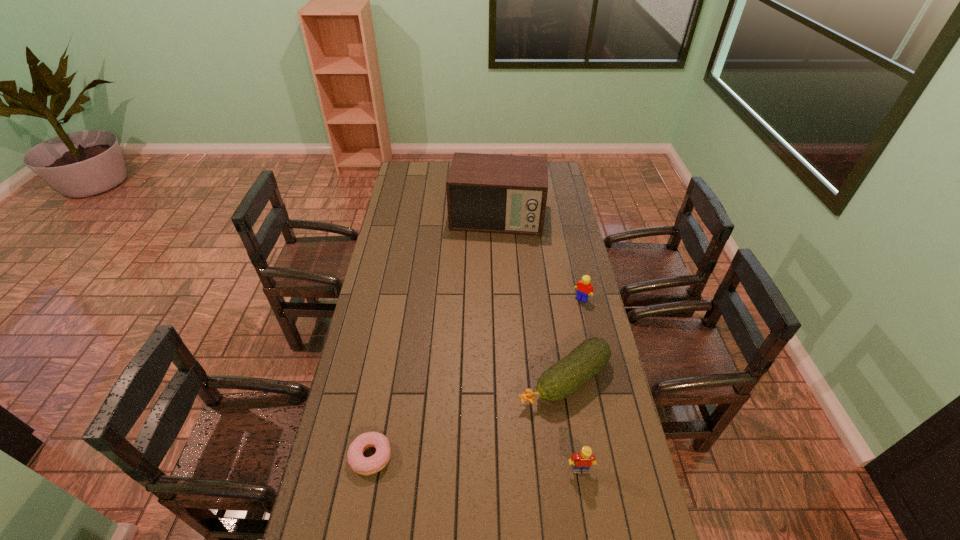
What are the coordinates of `free region located on the front-facing side of the farthest object` in the screenshot? It's located at (490, 270).

Locate an element on the screen. The height and width of the screenshot is (540, 960). vacant area situated 0.300m on the front-facing side of the farthest object is located at coordinates (488, 285).

Find the location of a particular element. vacant space located 0.130m on the front-facing side of the farthest object is located at coordinates (491, 258).

Where is `vacant space situated 0.090m on the front-facing side of the right Lego`? This screenshot has height=540, width=960. vacant space situated 0.090m on the front-facing side of the right Lego is located at coordinates pyautogui.click(x=567, y=316).

You are a GUI agent. You are given a task and a screenshot of the screen. Output one action in this format:
    pyautogui.click(x=<x>, y=<y>)
    Task: Click on the vacant space located 0.360m on the front-facing side of the right Lego
    This screenshot has width=960, height=540.
    Given the screenshot: What is the action you would take?
    pyautogui.click(x=532, y=363)

The height and width of the screenshot is (540, 960). In order to click on free space located on the front-facing side of the right Lego in this screenshot , I will do `click(545, 345)`.

In order to click on vacant space located 0.300m at the blossom end of the cucumber in this screenshot , I will do `click(453, 451)`.

The image size is (960, 540). Identify the location of vacant space located at the blossom end of the cucumber. (x=501, y=416).

Where is `vacant space located 0.320m at the blossom end of the cucumber`? This screenshot has width=960, height=540. vacant space located 0.320m at the blossom end of the cucumber is located at coordinates (447, 455).

The width and height of the screenshot is (960, 540). I want to click on object located in the left edge section of the desktop, so click(x=359, y=464).